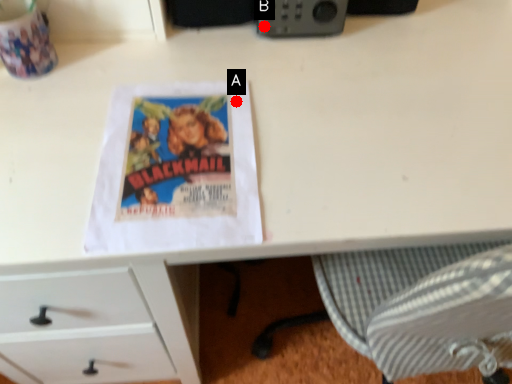
Question: Two points are circled on the image, labeled by A and B beside each circle. Which point is closer to the camera?

Choices:
 (A) A is closer
 (B) B is closer

Answer: (A)